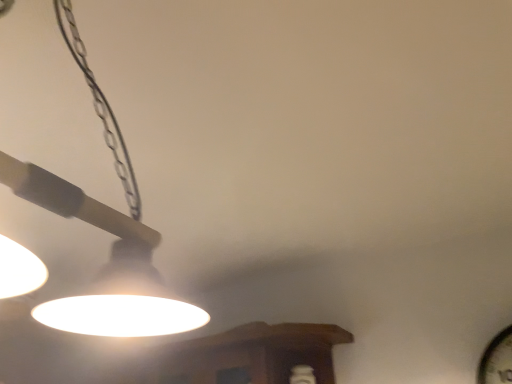
You are a GUI agent. You are given a task and a screenshot of the screen. Output one action in this format:
    pyautogui.click(x=<x>, y=<y>)
    Task: Click on the matte black lampshade at upper left
    The width and height of the screenshot is (512, 384).
    Given the screenshot: What is the action you would take?
    coord(106,231)

Measure the distance between point [151,329] and camera.

Point [151,329] and camera are 28.78 inches apart.

Image resolution: width=512 pixels, height=384 pixels. Describe the element at coordinates (106, 231) in the screenshot. I see `matte black lampshade at upper left` at that location.

I want to click on matte black lampshade at upper left, so click(106, 231).